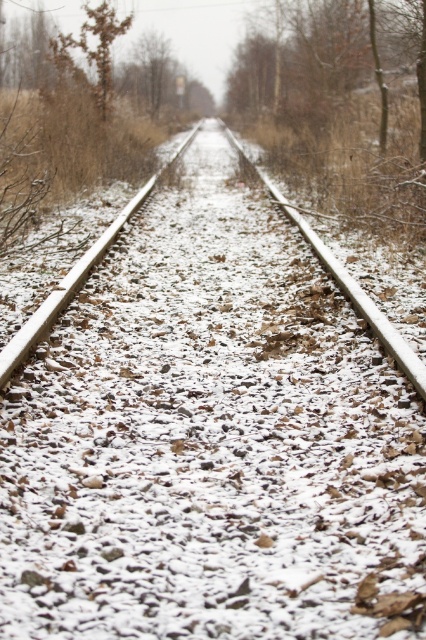
Question: Among these objects, which one is nearest to the camera?

Choices:
 (A) brown wood tree at upper center
 (B) snow-covered metal train track at center

Answer: (B)

Question: Among these points, which one is farthest from the camera?

Choices:
 (A) (111, 29)
 (B) (402, 348)

Answer: (A)

Question: Among these points, which one is nearest to the camera?

Choices:
 (A) (100, 52)
 (B) (386, 332)
 (C) (316, 131)

Answer: (B)

Question: Does brown wood tree at upper center have a larger size compared to snow-covered metal train track at center?

Choices:
 (A) yes
 (B) no

Answer: (A)

Question: Can you confirm if snow-covered metal train track at center is positioned to the right of brown textured tree at upper left?

Choices:
 (A) no
 (B) yes

Answer: (B)

Question: Can you confirm if snow-covered metal train track at center is bigger than brown textured tree at upper left?

Choices:
 (A) no
 (B) yes

Answer: (B)